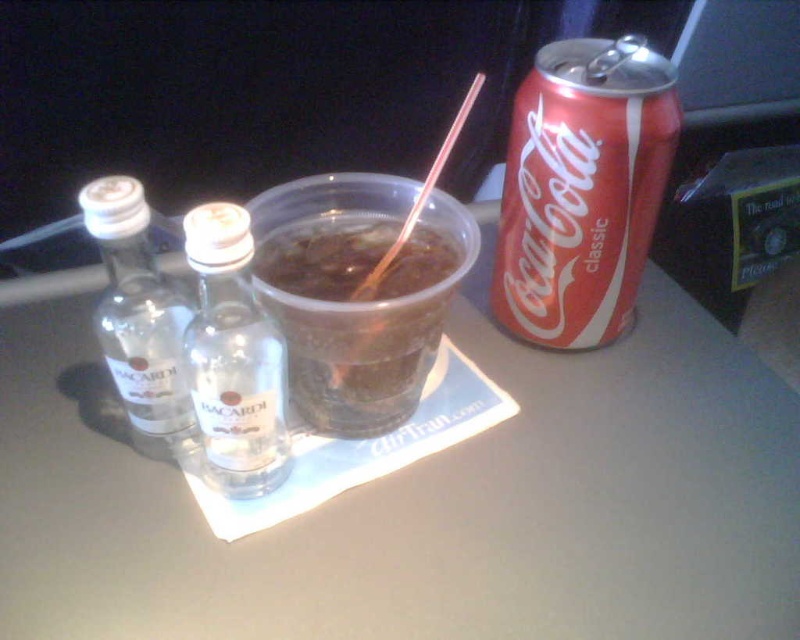
Does red matte coca-cola can at right appear on the right side of translucent plastic cup at center?

Indeed, red matte coca-cola can at right is positioned on the right side of translucent plastic cup at center.

Does red matte coca-cola can at right have a larger size compared to translucent plastic cup at center?

Yes, red matte coca-cola can at right is bigger than translucent plastic cup at center.

You are a GUI agent. You are given a task and a screenshot of the screen. Output one action in this format:
    pyautogui.click(x=<x>, y=<y>)
    Task: Click on the red matte coca-cola can at right
    The width and height of the screenshot is (800, 640).
    Given the screenshot: What is the action you would take?
    [x=582, y=189]

Based on the photo, does red matte coca-cola can at right have a greater width compared to clear glass bottle at center?

Yes.

Between red matte coca-cola can at right and clear glass bottle at center, which one appears on the right side from the viewer's perspective?

red matte coca-cola can at right

Is point (538, 211) closer to camera compared to point (206, 209)?

That is False.

Locate an element on the screen. The image size is (800, 640). red matte coca-cola can at right is located at coordinates (582, 189).

Who is more distant from viewer, (x=590, y=634) or (x=330, y=323)?

A: Positioned behind is point (x=330, y=323).

Can you confirm if clear plastic table at center is wider than translucent plastic cup at center?

Indeed, clear plastic table at center has a greater width compared to translucent plastic cup at center.

Who is more forward, (66, 324) or (304, 308)?

Point (304, 308) is in front.

Where is `clear plastic table at center`? The height and width of the screenshot is (640, 800). clear plastic table at center is located at coordinates (425, 502).